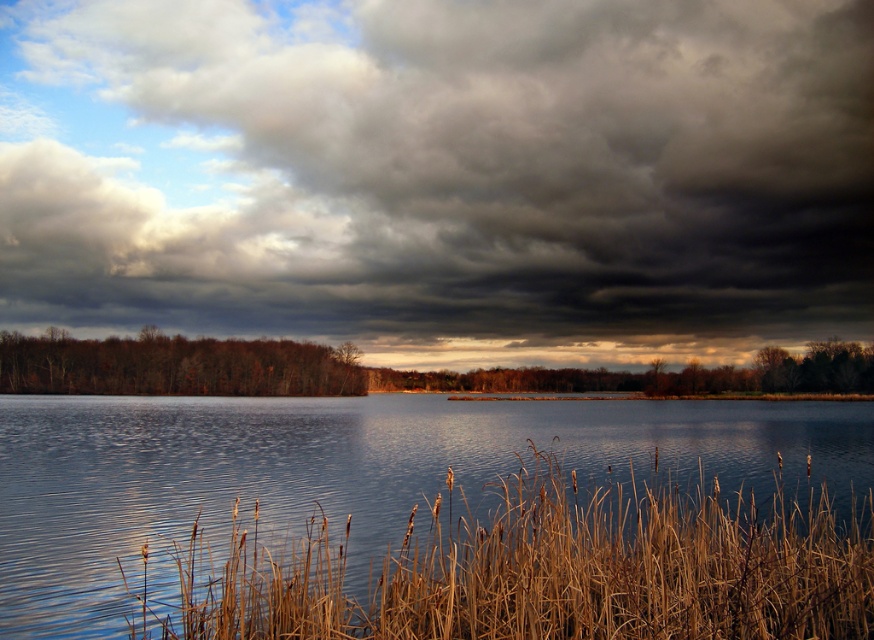
Who is lower down, dark gray cloud at upper center or dry grass at lower center?

dry grass at lower center is lower down.

The image size is (874, 640). Identify the location of dark gray cloud at upper center. (442, 176).